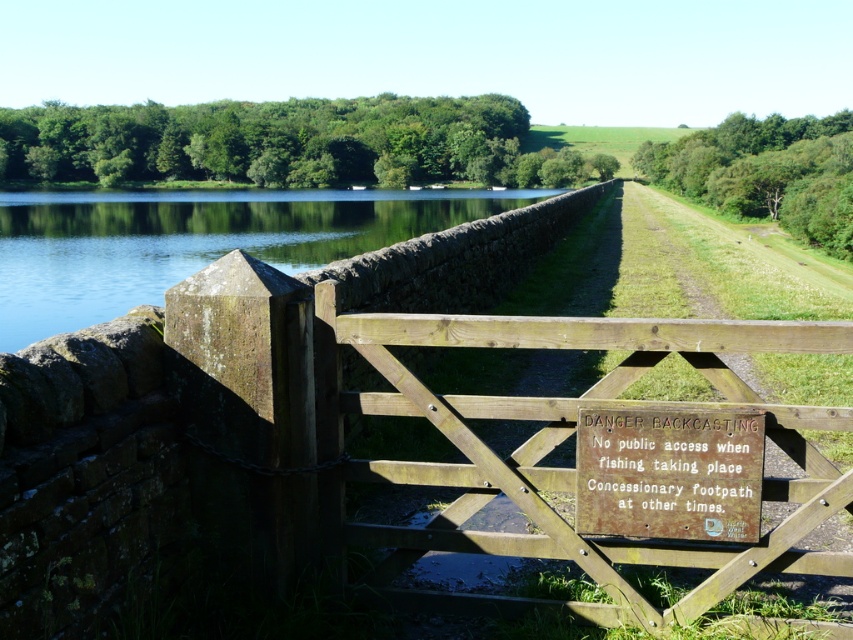
Which is behind, point (1, 250) or point (717, 518)?

Point (1, 250)

Does green stone wall at upper left appear on the right side of rusty wooden sign at center?

In fact, green stone wall at upper left is to the left of rusty wooden sign at center.

Between point (196, 221) and point (753, 508), which one is positioned behind?

Positioned behind is point (196, 221).

Where is `green stone wall at upper left`? The height and width of the screenshot is (640, 853). green stone wall at upper left is located at coordinates (190, 241).